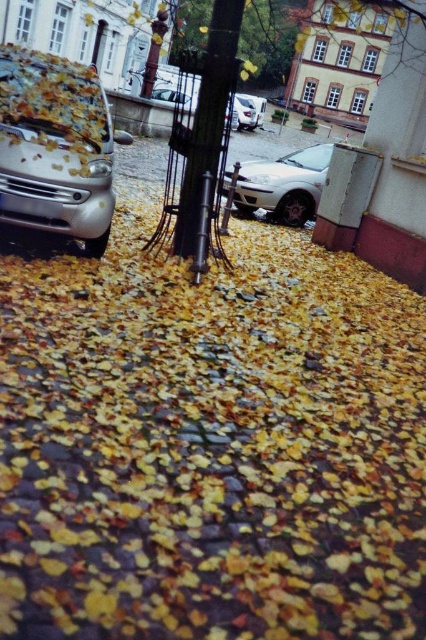
Is matte metallic car at left to the left of metallic pole at center from the viewer's perspective?

No, matte metallic car at left is not to the left of metallic pole at center.

Who is taller, matte metallic car at left or metallic pole at center?

metallic pole at center

Image resolution: width=426 pixels, height=640 pixels. In order to click on matte metallic car at left in this screenshot , I will do `click(54, 147)`.

Identify the location of matte metallic car at left. This screenshot has width=426, height=640. pyautogui.click(x=54, y=147).

Is point (279, 172) positioned in front of point (155, 92)?

Yes.

Is point (275, 198) more distant than point (166, 90)?

No, (275, 198) is closer to viewer.

Is point (249, 202) positioned in front of point (187, 108)?

No.

Where is `white matte car at center`? The image size is (426, 640). white matte car at center is located at coordinates (284, 184).

Does black metal pole at center appear under metallic silver sedan at center?

Correct, black metal pole at center is located below metallic silver sedan at center.

Does black metal pole at center appear on the right side of metallic silver sedan at center?

Yes, black metal pole at center is to the right of metallic silver sedan at center.

What do you see at coordinates (207, 134) in the screenshot? I see `black metal pole at center` at bounding box center [207, 134].

Where is `black metal pole at center`? black metal pole at center is located at coordinates [x=207, y=134].